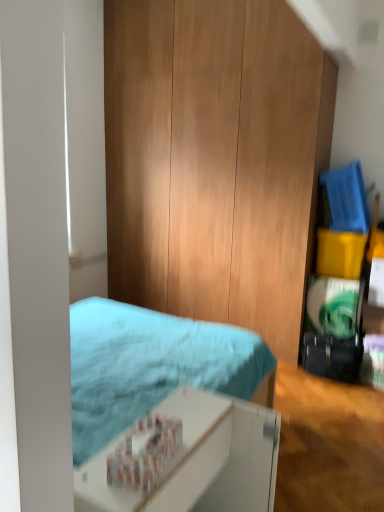
Question: Would you say white cardboard box at lower center is inside or outside yellow matte box at right?

Choices:
 (A) outside
 (B) inside

Answer: (A)

Question: Is white cardboard box at lower center wider or thinner than yellow matte box at right?

Choices:
 (A) wide
 (B) thin

Answer: (B)

Question: In terms of height, does white cardboard box at lower center look taller or shorter compared to yellow matte box at right?

Choices:
 (A) tall
 (B) short

Answer: (A)

Question: From a real-world perspective, is yellow matte box at right above or below white cardboard box at lower center?

Choices:
 (A) below
 (B) above

Answer: (B)

Question: Is yellow matte box at right bigger or smaller than white cardboard box at lower center?

Choices:
 (A) small
 (B) big

Answer: (A)

Question: Is yellow matte box at right wider or thinner than white cardboard box at lower center?

Choices:
 (A) thin
 (B) wide

Answer: (B)

Question: Considering their positions, is yellow matte box at right located in front of or behind white cardboard box at lower center?

Choices:
 (A) front
 (B) behind

Answer: (B)